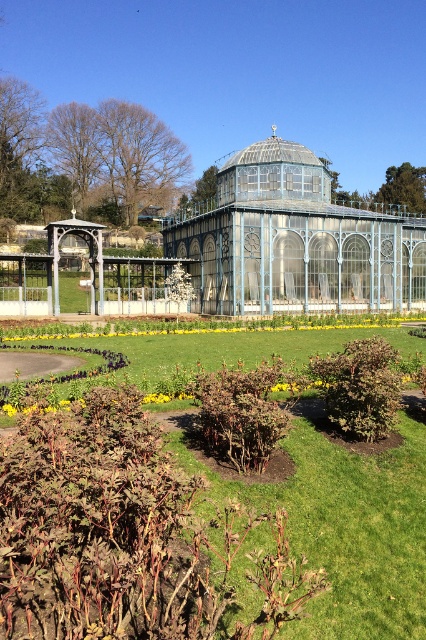
Can you confirm if green leafy bush at center is positioned below blue glass gazebo at center?

Indeed, green leafy bush at center is positioned under blue glass gazebo at center.

You are a GUI agent. You are given a task and a screenshot of the screen. Output one action in this format:
    pyautogui.click(x=<x>, y=<y>)
    Task: Click on the green leafy bush at center
    This screenshot has height=640, width=426.
    Given the screenshot: What is the action you would take?
    pyautogui.click(x=95, y=524)